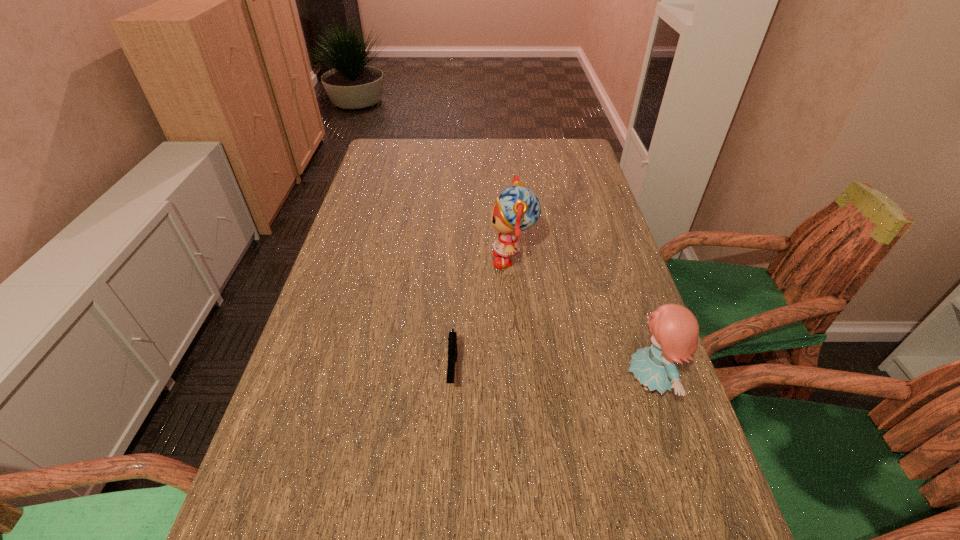
Locate an element on the screen. The image size is (960, 540). free area in between the right doll and the shortest object is located at coordinates (551, 377).

Identify the location of free space between the farther doll and the pistol. This screenshot has height=540, width=960. (483, 315).

Where is `vacant area between the leftmost object and the left doll`? vacant area between the leftmost object and the left doll is located at coordinates (483, 315).

You are a GUI agent. You are given a task and a screenshot of the screen. Output one action in this format:
    pyautogui.click(x=<x>, y=<y>)
    Task: Click on the free space between the farthest object and the shortest object
    Image resolution: width=960 pixels, height=540 pixels.
    Given the screenshot: What is the action you would take?
    pyautogui.click(x=483, y=315)

The image size is (960, 540). In order to click on free spot between the nearer doll and the leftmost object in this screenshot , I will do `click(551, 377)`.

What are the coordinates of `unoccupied area between the farthest object and the nearer doll` in the screenshot? It's located at (581, 321).

Where is `vacant area that lies between the right doll and the leftmost object`? The height and width of the screenshot is (540, 960). vacant area that lies between the right doll and the leftmost object is located at coordinates (551, 377).

Locate an element on the screen. This screenshot has height=540, width=960. object that stands as the closest to the farthest object is located at coordinates (452, 340).

Locate which object is the closest to the nearer doll. Please provide its 2D coordinates. Your answer should be formatted as a tuple, i.e. [(x, y)], where the tuple contains the x and y coordinates of a point satisfying the conditions above.

[(517, 209)]

Where is `free location that satisfies the following two spatial constraints: 1. on the face of the second object from right to left; 2. on the front-facing side of the leftmost object`? This screenshot has height=540, width=960. free location that satisfies the following two spatial constraints: 1. on the face of the second object from right to left; 2. on the front-facing side of the leftmost object is located at coordinates (522, 372).